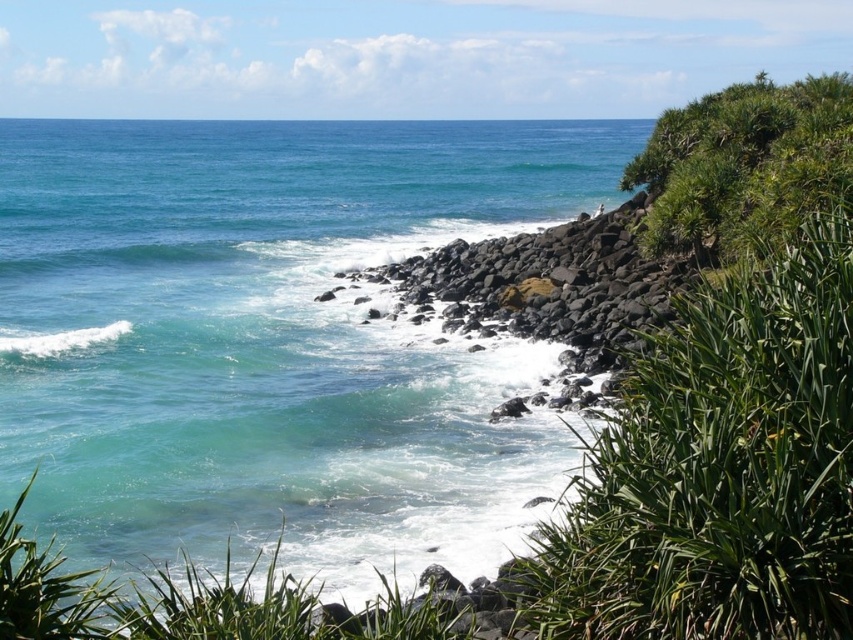
Between teal water at center and green leafy plant at right, which one is positioned higher?

teal water at center is higher up.

Identify the location of teal water at center. The height and width of the screenshot is (640, 853). (273, 339).

Can you confirm if teal water at center is bigger than green leafy shrub at upper right?

Correct, teal water at center is larger in size than green leafy shrub at upper right.

Which is in front, point (172, 432) or point (724, 156)?

Point (172, 432)

Locate an element on the screen. This screenshot has height=640, width=853. teal water at center is located at coordinates (273, 339).

Which is above, green leafy plant at right or green leafy shrub at upper right?

green leafy shrub at upper right is higher up.

Who is lower down, green leafy plant at right or green leafy shrub at upper right?

green leafy plant at right

Describe the element at coordinates (718, 467) in the screenshot. I see `green leafy plant at right` at that location.

Where is `green leafy plant at right`? This screenshot has height=640, width=853. green leafy plant at right is located at coordinates (718, 467).